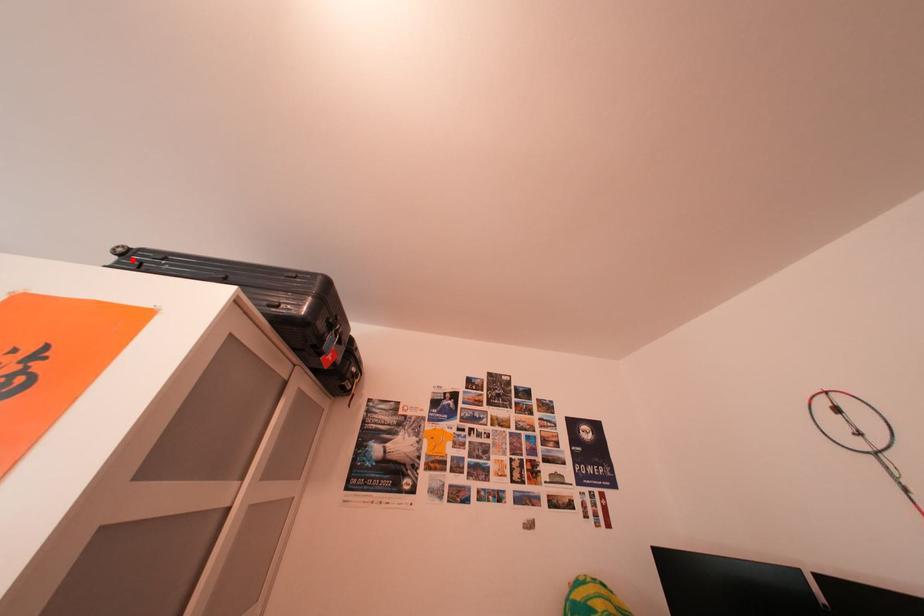
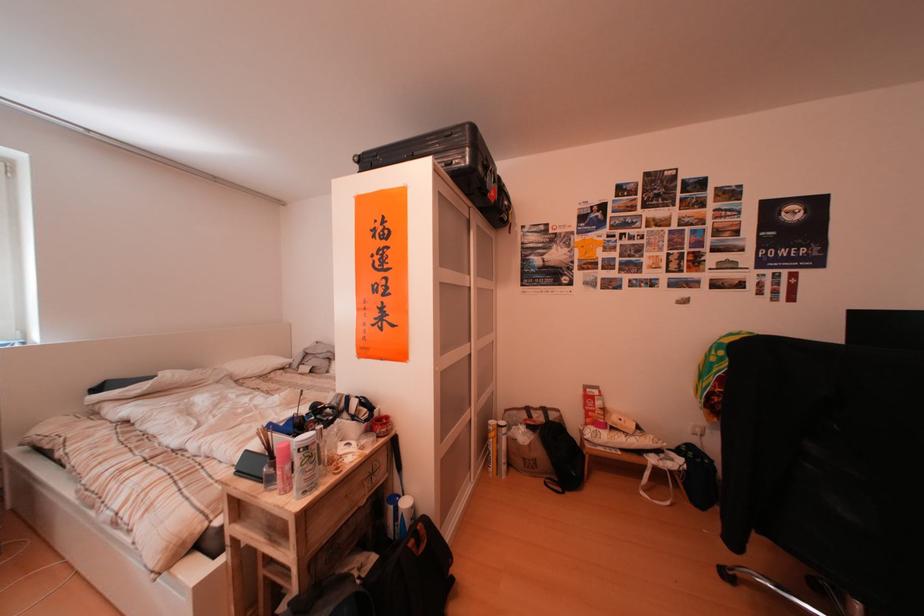
Question: I am providing you with two images of the same scene from different viewpoints. A red point is shown in image1. For the corresponding object point in image2, is it positioned nearer or farther from the camera?

Choices:
 (A) Nearer
 (B) Farther

Answer: (A)